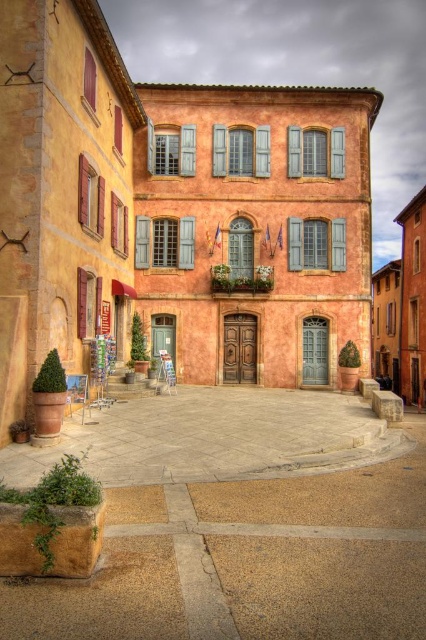
You are planning to place a large rectangular garden bench in the courtyard. The bench is as wide as the blue wood shutter at upper left. Will the smooth stone courtyard at center have enough space to accommodate the bench without moving any existing structures?

The smooth stone courtyard at center has a width larger than the blue wood shutter at upper left. Since the bench is as wide as the shutter, the courtyard should have sufficient space to accommodate it without needing to move any existing structures.

You are an architect designing a model of this building. You have two blue wood shutters to place on the facade. The blue painted wood shutter at center and the blue wood shutter at upper left. Which one should you make larger in your model to match the actual building?

You should make the blue painted wood shutter at center larger than the blue wood shutter at upper left in your model to match the actual building.

You are a painter who needs to decide which object to paint first. The blue wood window at center and the blue wood shutters at upper left are both in your view. Which one requires less paint due to its size?

The blue wood window at center requires less paint because it has a smaller size compared to the blue wood shutters at upper left.